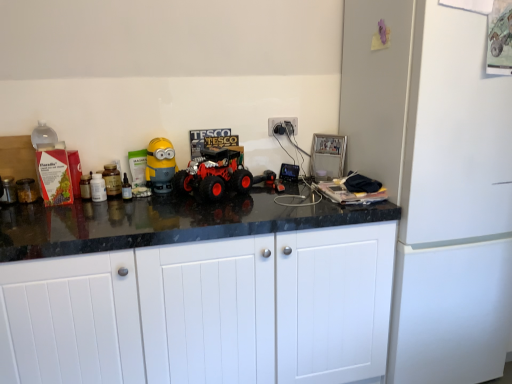
What do you see at coordinates (205, 311) in the screenshot?
I see `white matte cabinet doors at center` at bounding box center [205, 311].

Locate an element on the screen. The image size is (512, 384). white matte refrigerator at right is located at coordinates (436, 182).

What do you see at coordinates (281, 122) in the screenshot? The image size is (512, 384). I see `white plastic electric outlet at upper right` at bounding box center [281, 122].

Describe the element at coordinates (327, 156) in the screenshot. This screenshot has height=384, width=512. I see `metallic silver frame at upper right` at that location.

Where is `yellow matte toy at center, which is the 1th toy in left-to-right order`? The image size is (512, 384). yellow matte toy at center, which is the 1th toy in left-to-right order is located at coordinates (160, 165).

Identify the location of rubberized red toy truck at center. The image size is (512, 384). (214, 174).

Is rubberized black toy truck at center, which is counted as the 1th toy, starting from the right, inside or outside of white plastic electric outlet at upper right?

rubberized black toy truck at center, which is counted as the 1th toy, starting from the right, exists outside the volume of white plastic electric outlet at upper right.

Relative to white plastic electric outlet at upper right, is rubberized black toy truck at center, which is counted as the 1th toy, starting from the right, in front or behind?

Clearly, rubberized black toy truck at center, which is counted as the 1th toy, starting from the right, is in front of white plastic electric outlet at upper right.

Considering the sizes of objects rubberized black toy truck at center, which ranks as the second toy in left-to-right order, and white plastic electric outlet at upper right in the image provided, who is thinner, rubberized black toy truck at center, which ranks as the second toy in left-to-right order, or white plastic electric outlet at upper right?

white plastic electric outlet at upper right is thinner.

Looking at this image, is white plastic electric outlet at upper right aimed at white matte refrigerator at right?

No, white plastic electric outlet at upper right is not oriented towards white matte refrigerator at right.

From a real-world perspective, relative to white matte refrigerator at right, is white plastic electric outlet at upper right vertically above or below?

Clearly, from a real-world perspective, white plastic electric outlet at upper right is above white matte refrigerator at right.

At what (x,y) coordinates should I click in order to perform the action: click on electric outlet positioned vertically above the white matte refrigerator at right (from a real-world perspective). Please return your answer as a coordinate pair (x, y). The height and width of the screenshot is (384, 512). Looking at the image, I should click on (281, 122).

From the picture: Which is more to the left, white plastic electric outlet at upper right or white matte refrigerator at right?

Positioned to the left is white plastic electric outlet at upper right.

Find the location of a particular element. This screenshot has height=384, width=512. cabinetry on the right of translucent plastic bottle at center is located at coordinates [x=205, y=311].

Which object is closer to the camera, translucent plastic bottle at center or white matte cabinet doors at center?

white matte cabinet doors at center is in front.

Considering the relative positions of rubberized red toy truck at center and white matte cabinet doors at center in the image provided, is rubberized red toy truck at center in front of white matte cabinet doors at center?

No, rubberized red toy truck at center is behind white matte cabinet doors at center.

From the image's perspective, who appears lower, rubberized red toy truck at center or white matte cabinet doors at center?

white matte cabinet doors at center, from the image's perspective.

From the picture: Which point is more distant from viewer, (221, 167) or (65, 286)?

Positioned behind is point (221, 167).

Considering the relative sizes of rubberized black toy truck at center, which ranks as the second toy in left-to-right order, and translucent plastic bottle at center in the image provided, is rubberized black toy truck at center, which ranks as the second toy in left-to-right order, shorter than translucent plastic bottle at center?

Yes, rubberized black toy truck at center, which ranks as the second toy in left-to-right order, is shorter than translucent plastic bottle at center.

From a real-world perspective, is rubberized black toy truck at center, which is counted as the 1th toy, starting from the right, positioned over translucent plastic bottle at center based on gravity?

No, from a real-world perspective, rubberized black toy truck at center, which is counted as the 1th toy, starting from the right, is not above translucent plastic bottle at center.

From the translucent plastic bottle at center, count 2nd toy to the right and point to it. Please provide its 2D coordinates.

[(269, 181)]

From the picture: Considering the relative sizes of metallic silver frame at upper right and yellow matte toy at center, the second toy positioned from the right, in the image provided, is metallic silver frame at upper right shorter than yellow matte toy at center, the second toy positioned from the right,?

Correct, metallic silver frame at upper right is not as tall as yellow matte toy at center, the second toy positioned from the right.

What's the angular difference between metallic silver frame at upper right and yellow matte toy at center, which is the 1th toy in left-to-right order,'s facing directions?

The angle between the facing direction of metallic silver frame at upper right and the facing direction of yellow matte toy at center, which is the 1th toy in left-to-right order, is 45 degrees.

Is metallic silver frame at upper right completely or partially outside of yellow matte toy at center, the second toy positioned from the right?

Yes, metallic silver frame at upper right is not within yellow matte toy at center, the second toy positioned from the right.

Relative to yellow matte toy at center, which is the 1th toy in left-to-right order, is white plastic electric outlet at upper right in front or behind?

In the image, white plastic electric outlet at upper right appears behind yellow matte toy at center, which is the 1th toy in left-to-right order.

Does white plastic electric outlet at upper right have a smaller size compared to yellow matte toy at center, the second toy positioned from the right?

Correct, white plastic electric outlet at upper right occupies less space than yellow matte toy at center, the second toy positioned from the right.

Is white plastic electric outlet at upper right oriented away from yellow matte toy at center, the second toy positioned from the right?

white plastic electric outlet at upper right does not have its back to yellow matte toy at center, the second toy positioned from the right.

Does white plastic electric outlet at upper right have a greater width compared to yellow matte toy at center, the second toy positioned from the right?

Incorrect, the width of white plastic electric outlet at upper right does not surpass that of yellow matte toy at center, the second toy positioned from the right.

Locate an element on the screen. Image resolution: width=512 pixels, height=384 pixels. electric outlet behind the rubberized black toy truck at center, which is counted as the 1th toy, starting from the right is located at coordinates (281, 122).

Where is `electric outlet on the left of white matte refrigerator at right`? electric outlet on the left of white matte refrigerator at right is located at coordinates (281, 122).

Which object lies further to the anchor point yellow matte toy at center, which is the 1th toy in left-to-right order, translucent plastic bottle at center or rubberized black toy truck at center, which is counted as the 1th toy, starting from the right?

Based on the image, rubberized black toy truck at center, which is counted as the 1th toy, starting from the right, appears to be further to yellow matte toy at center, which is the 1th toy in left-to-right order.

Considering their positions, is white plastic electric outlet at upper right positioned further to translucent plastic bottle at center than white matte refrigerator at right?

white matte refrigerator at right.

When comparing their distances from rubberized red toy truck at center, does white matte refrigerator at right or rubberized black toy truck at center, which ranks as the second toy in left-to-right order, seem closer?

rubberized black toy truck at center, which ranks as the second toy in left-to-right order, is positioned closer to the anchor rubberized red toy truck at center.

Considering their positions, is white matte cabinet doors at center positioned further to white matte refrigerator at right than translucent plastic bottle at center?

translucent plastic bottle at center is positioned further to the anchor white matte refrigerator at right.

When comparing their distances from white plastic electric outlet at upper right, does white matte refrigerator at right or white matte cabinet doors at center seem further?

white matte cabinet doors at center.

Looking at the image, which one is located closer to rubberized red toy truck at center, metallic silver frame at upper right or rubberized black toy truck at center, which ranks as the second toy in left-to-right order?

The object closer to rubberized red toy truck at center is rubberized black toy truck at center, which ranks as the second toy in left-to-right order.

Looking at the image, which one is located closer to rubberized red toy truck at center, white plastic electric outlet at upper right or white matte refrigerator at right?

white plastic electric outlet at upper right is positioned closer to the anchor rubberized red toy truck at center.

Which object lies further to the anchor point white matte refrigerator at right, translucent plastic bottle at center or rubberized black toy truck at center, which ranks as the second toy in left-to-right order?

Based on the image, translucent plastic bottle at center appears to be further to white matte refrigerator at right.

Identify the location of land vehicle between yellow matte toy at center, the second toy positioned from the right, and white matte cabinet doors at center vertically. (214, 174).

Identify the location of appliance between rubberized black toy truck at center, which ranks as the second toy in left-to-right order, and white matte refrigerator at right. (327, 156).

At what (x,y) coordinates should I click in order to perform the action: click on land vehicle between white matte cabinet doors at center and metallic silver frame at upper right in the front-back direction. Please return your answer as a coordinate pair (x, y). The height and width of the screenshot is (384, 512). Looking at the image, I should click on (214, 174).

I want to click on bottle that lies between yellow matte toy at center, the second toy positioned from the right, and white matte cabinet doors at center from top to bottom, so tap(126, 189).